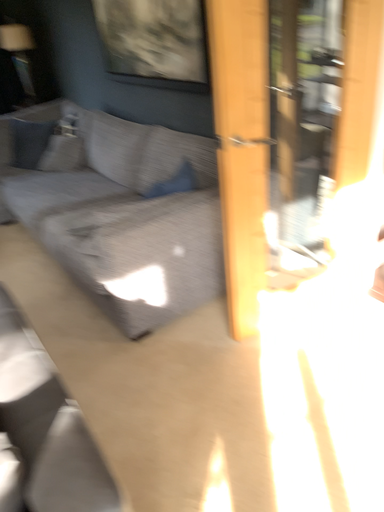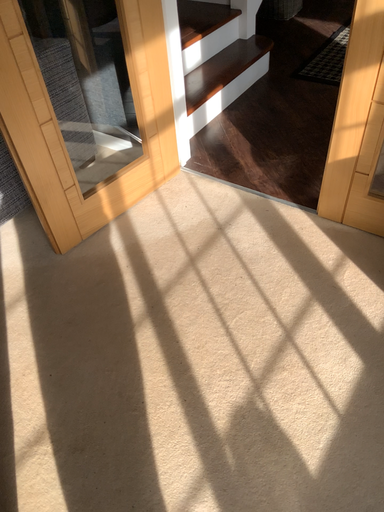
Question: Which way did the camera rotate in the video?

Choices:
 (A) rotated downward
 (B) rotated upward

Answer: (A)